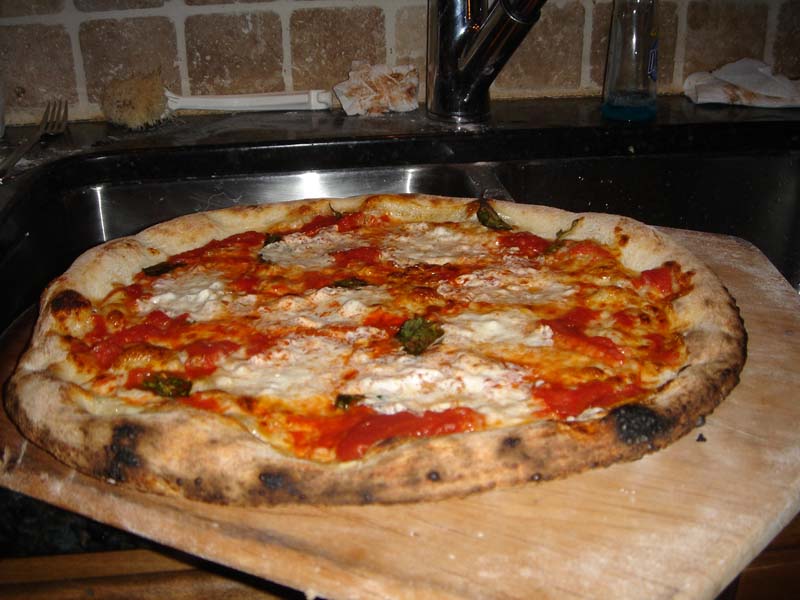
Locate an element on the screen. This screenshot has width=800, height=600. wooden pizza peel is located at coordinates (526, 529).